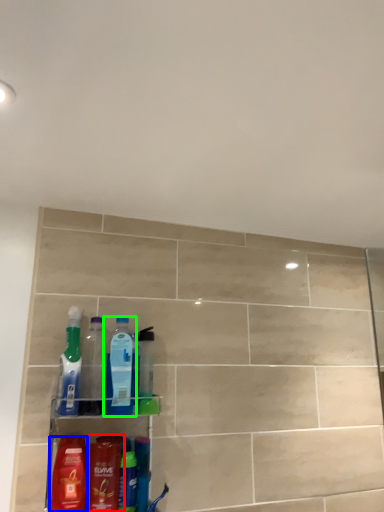
Question: Which is nearer to the mouthwash (highlighted by a red box)? cleaning product (highlighted by a blue box) or bottle (highlighted by a green box).

Choices:
 (A) cleaning product
 (B) bottle

Answer: (A)